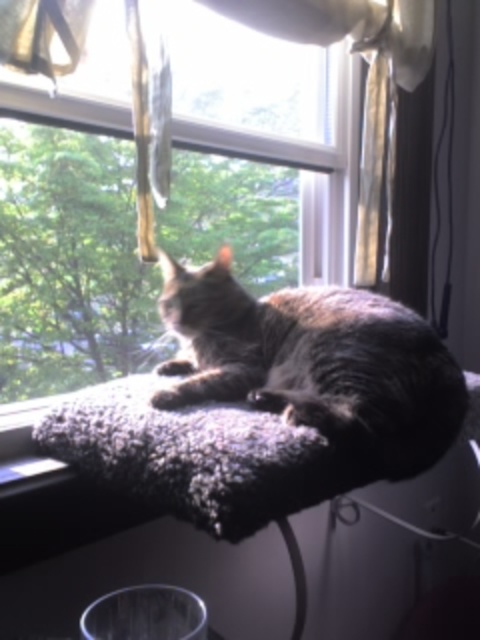
Find the location of a particular element. gray fur cat at center is located at coordinates (315, 362).

Is gray fur cat at center wider than fuzzy fabric cat bed at upper center?

No.

Between point (403, 388) and point (152, 428), which one is positioned behind?

The point (403, 388) is behind.

Where is `gray fur cat at center`? gray fur cat at center is located at coordinates (315, 362).